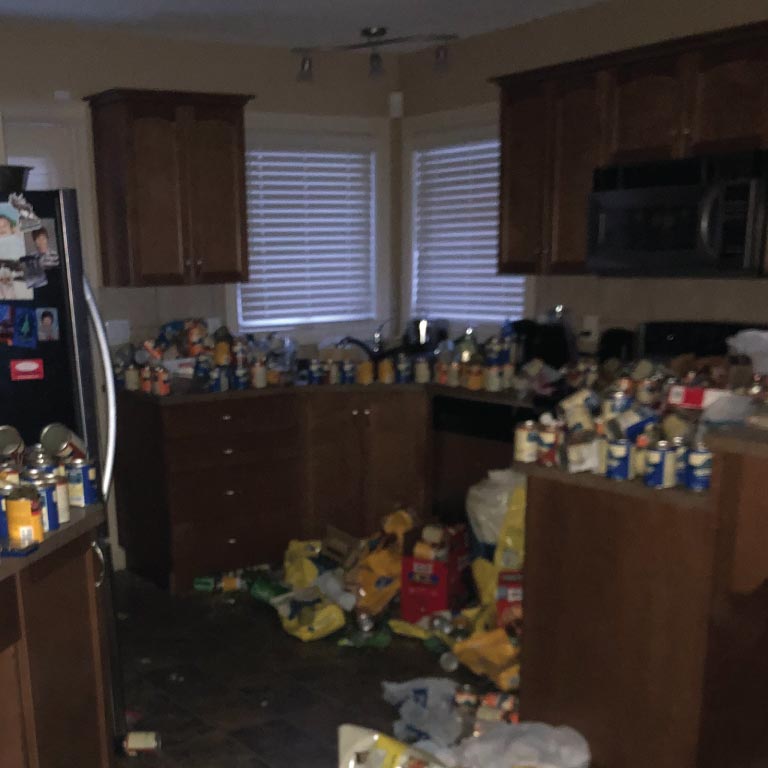
Image resolution: width=768 pixels, height=768 pixels. In order to click on windows in this screenshot , I will do `click(309, 229)`, `click(452, 259)`.